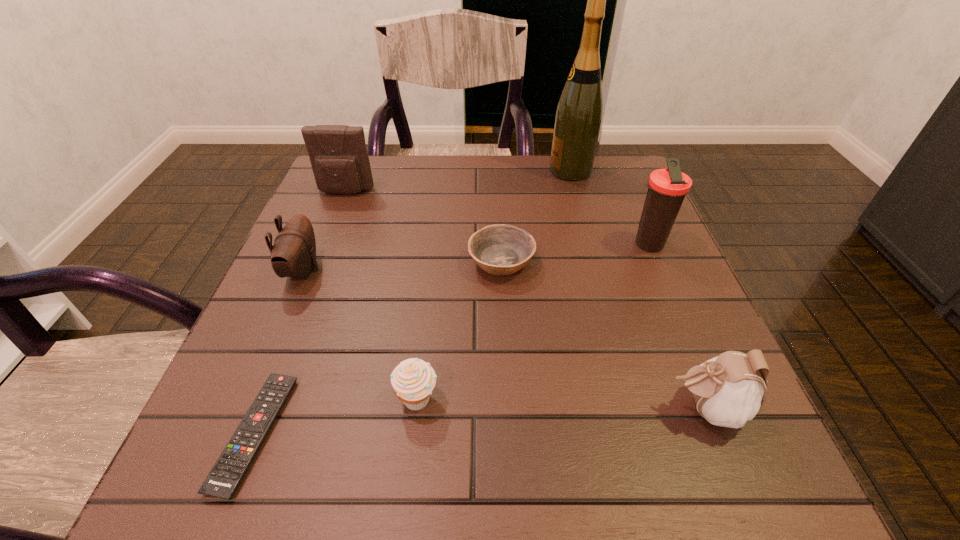
Where is `the farthest object`? Image resolution: width=960 pixels, height=540 pixels. the farthest object is located at coordinates (579, 113).

Locate an element on the screen. This screenshot has width=960, height=540. wine bottle is located at coordinates (579, 113).

Find the location of a particular element. Image resolution: width=960 pixels, height=540 pixels. thermos bottle is located at coordinates click(x=667, y=188).

Locate an element on the screen. Image resolution: width=960 pixels, height=540 pixels. the sixth shortest object is located at coordinates (338, 155).

Locate an element on the screen. the second farthest object is located at coordinates (338, 155).

Identify the location of the nearest pouch. (729, 389).

Locate an element on the screen. The image size is (960, 540). the second nearest pouch is located at coordinates (293, 254).

Where is `the fifth object from right to left`? Image resolution: width=960 pixels, height=540 pixels. the fifth object from right to left is located at coordinates (413, 380).

The image size is (960, 540). I want to click on the third shortest object, so click(413, 380).

Identify the location of the seventh tallest object. (503, 249).